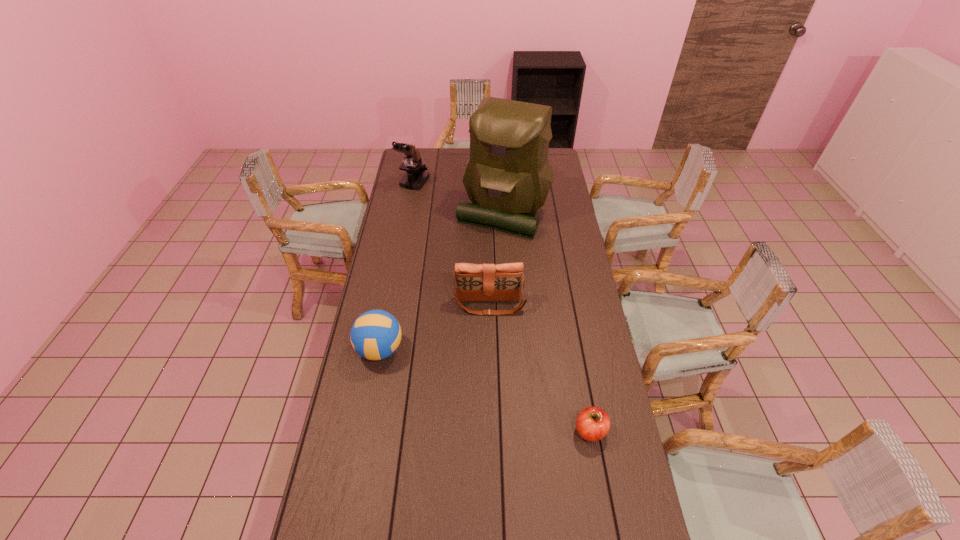
You are a GUI agent. You are given a task and a screenshot of the screen. Output one action in this format:
    pyautogui.click(x=<x>, y=<y>)
    Task: Click on the backpack
    The image size is (960, 540).
    Given the screenshot: What is the action you would take?
    pyautogui.click(x=508, y=176)

Locate an element on the screen. The width and height of the screenshot is (960, 540). the second tallest object is located at coordinates click(416, 176).

Find the location of a particular element. The height and width of the screenshot is (540, 960). shoulder bag is located at coordinates (483, 282).

You are a GUI agent. You are given a task and a screenshot of the screen. Output one action in this format:
    pyautogui.click(x=<x>, y=<y>)
    Task: Click on the second nearest object
    This screenshot has height=540, width=960.
    Given the screenshot: What is the action you would take?
    pyautogui.click(x=376, y=334)

Where is `the nearest object`? This screenshot has height=540, width=960. the nearest object is located at coordinates (593, 423).

The width and height of the screenshot is (960, 540). What are the coordinates of `apple` in the screenshot? It's located at (593, 423).

Where is `vacant space situated on the front of the backpack with visible pockets`? This screenshot has height=540, width=960. vacant space situated on the front of the backpack with visible pockets is located at coordinates (506, 265).

At what (x,y) coordinates should I click in order to perform the action: click on blank area located 0.390m on the front of the microscope. Please return your answer as a coordinate pair (x, y). The width and height of the screenshot is (960, 540). Looking at the image, I should click on tap(403, 245).

At what (x,y) coordinates should I click in order to perform the action: click on free space located on the front-facing side of the third farthest object. Please return your answer as a coordinate pair (x, y). Looking at the image, I should click on (492, 397).

Locate an element on the screen. free region located 0.350m on the front of the volleyball is located at coordinates (357, 471).